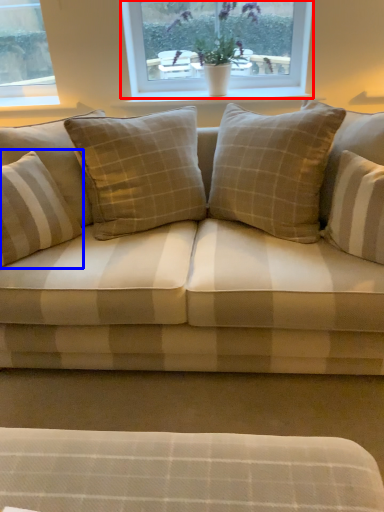
Question: Which point is closer to the camera, window (highlighted by a red box) or pillow (highlighted by a blue box)?

Choices:
 (A) window
 (B) pillow

Answer: (B)